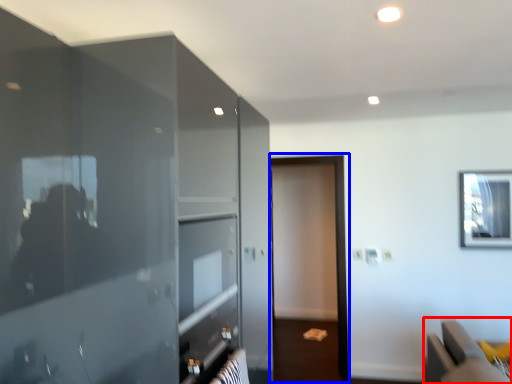
Question: Which object is closer to the camera taking this photo, furniture (highlighted by a red box) or screen door (highlighted by a blue box)?

Choices:
 (A) furniture
 (B) screen door

Answer: (A)